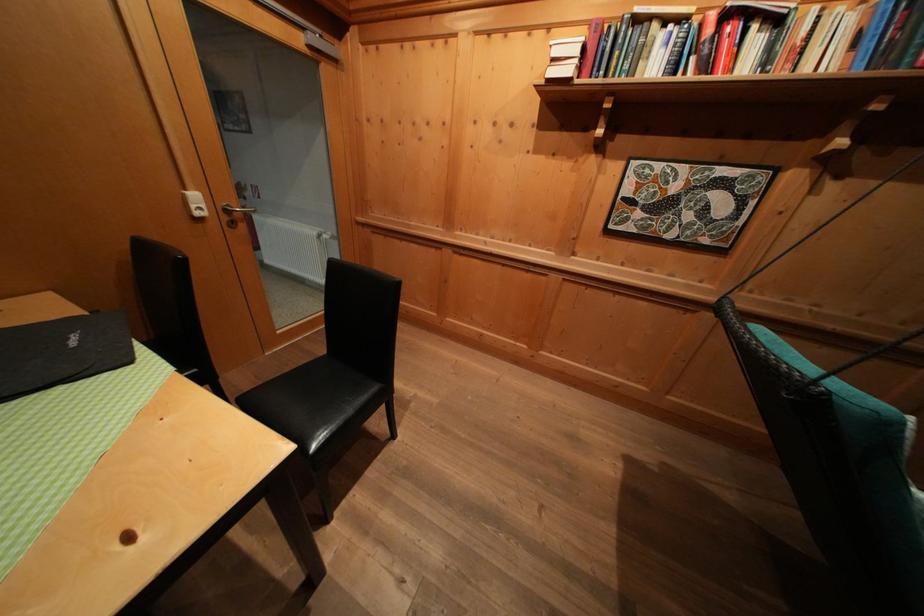
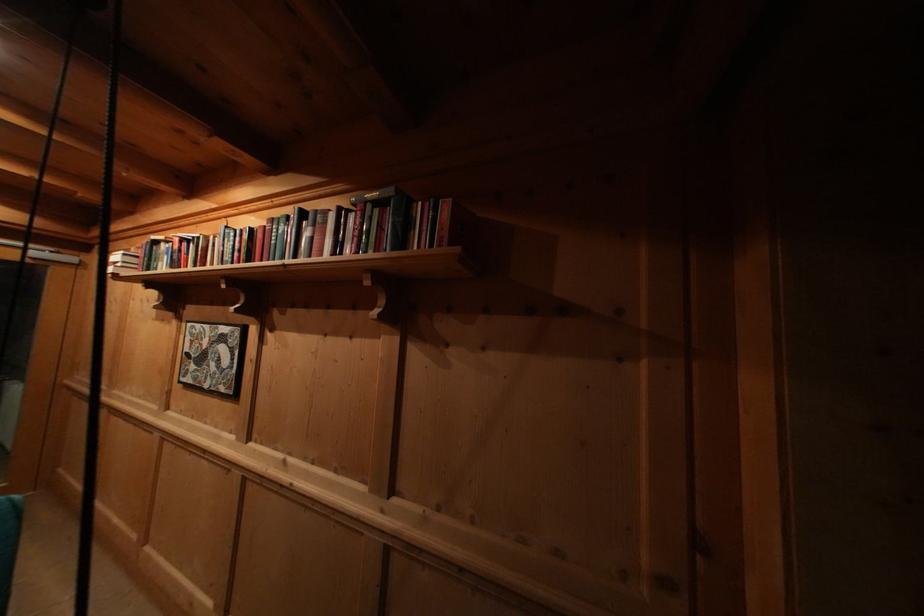
In the second image, find the point that corresponds to [665,171] in the first image.

(204, 331)